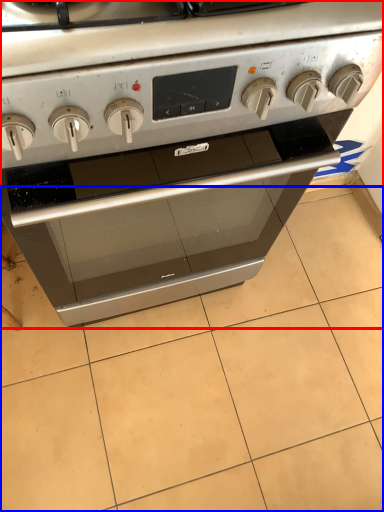
Question: Among these objects, which one is nearest to the camera, oven (highlighted by a red box) or tile (highlighted by a blue box)?

Choices:
 (A) oven
 (B) tile

Answer: (A)